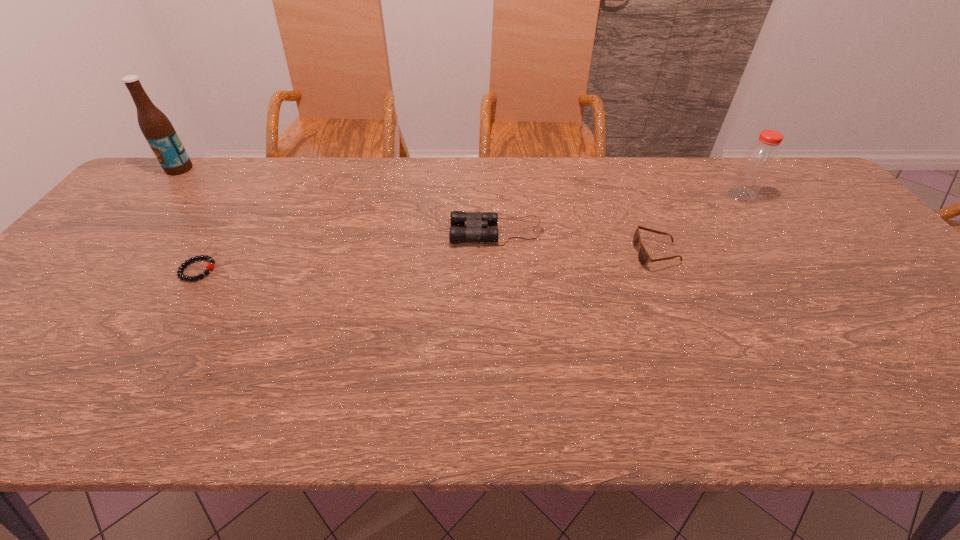
I want to click on vacant space situated 0.370m at the eyepiece of the third object from left to right, so click(317, 232).

Locate an element on the screen. The height and width of the screenshot is (540, 960). vacant position located at the eyepiece of the third object from left to right is located at coordinates (335, 232).

Identify the location of vacant area situated at the eyepiece of the third object from left to right. (339, 232).

Find the location of `free space located on the frames of the fourth object from left to right`. free space located on the frames of the fourth object from left to right is located at coordinates (590, 253).

Find the location of a particular element. This screenshot has width=960, height=540. vacant area situated 0.260m on the frames of the fourth object from left to right is located at coordinates (537, 253).

Find the location of a particular element. This screenshot has height=540, width=960. vacant space located on the frames of the fourth object from left to right is located at coordinates 571,253.

This screenshot has width=960, height=540. In order to click on blank space located on the right of the shortest object in this screenshot , I will do `click(321, 270)`.

You are a GUI agent. You are given a task and a screenshot of the screen. Output one action in this format:
    pyautogui.click(x=<x>, y=<y>)
    Task: Click on the beer bottle located in the far edge section of the desktop
    The width and height of the screenshot is (960, 540).
    Given the screenshot: What is the action you would take?
    pyautogui.click(x=157, y=129)

The height and width of the screenshot is (540, 960). What are the coordinates of `bottle situated at the far edge` in the screenshot? It's located at 759,161.

Identify the location of object that is at the left edge. Image resolution: width=960 pixels, height=540 pixels. (157, 129).